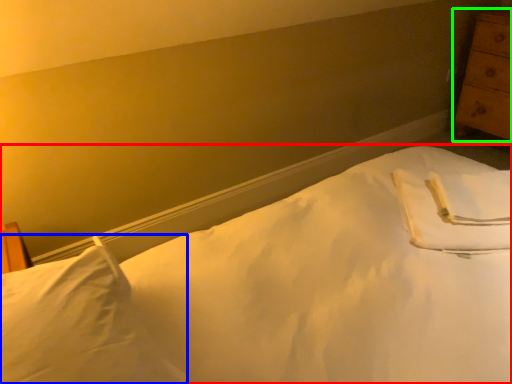
Question: Which object is the farthest from bed (highlighted by a red box)? Choose among these: pillow (highlighted by a blue box) or chest of drawers (highlighted by a green box).

Choices:
 (A) pillow
 (B) chest of drawers

Answer: (B)